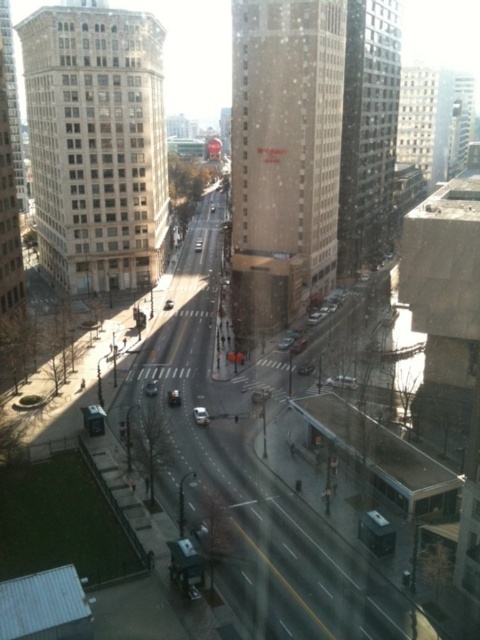
Between point (202, 422) and point (154, 387), which one is positioned behind?

Positioned behind is point (154, 387).

Locate an element on the screen. This screenshot has height=640, width=480. silver metallic sedan at center is located at coordinates point(201,416).

This screenshot has height=640, width=480. I want to click on silver metallic sedan at center, so click(x=201, y=416).